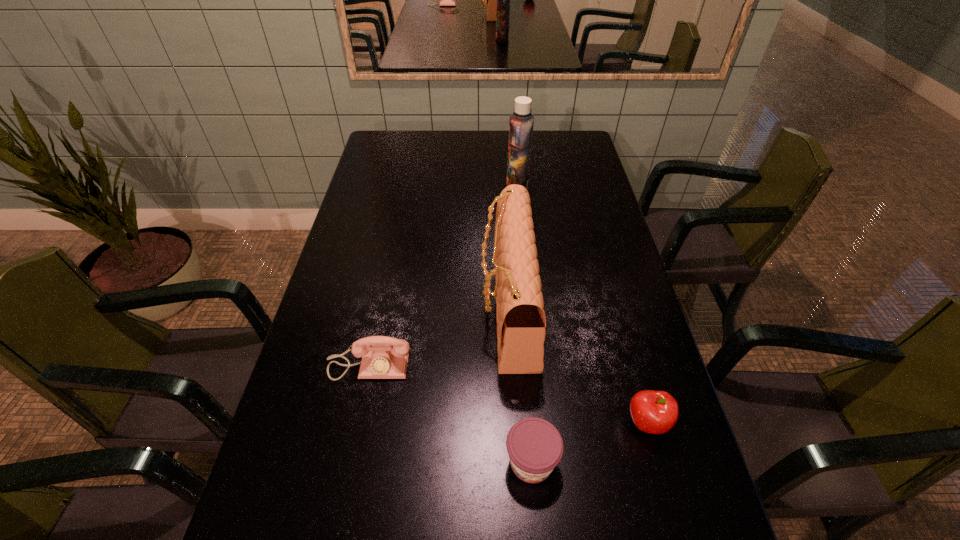
The width and height of the screenshot is (960, 540). In order to click on shampoo in this screenshot , I will do `click(521, 122)`.

The image size is (960, 540). What are the coordinates of `the tallest object` in the screenshot? It's located at tap(521, 122).

Find the location of `the fourth shortest object`. the fourth shortest object is located at coordinates (521, 321).

Identify the location of the rightmost object. Image resolution: width=960 pixels, height=540 pixels. (656, 412).

Identify the location of the leftmost object. The width and height of the screenshot is (960, 540). tap(383, 357).

At what (x,y) coordinates should I click in order to perform the action: click on jam. Please return your answer as a coordinate pair (x, y). Looking at the image, I should click on (535, 447).

The width and height of the screenshot is (960, 540). In order to click on free space located on the front label of the farthest object in this screenshot , I will do `click(432, 188)`.

The width and height of the screenshot is (960, 540). I want to click on vacant region located 0.400m on the front label of the farthest object, so click(397, 188).

The height and width of the screenshot is (540, 960). I want to click on free spot located 0.240m on the front label of the farthest object, so click(x=441, y=188).

This screenshot has height=540, width=960. In order to click on vacant space located 0.050m on the front-facing side of the handbag in this screenshot , I will do `click(463, 308)`.